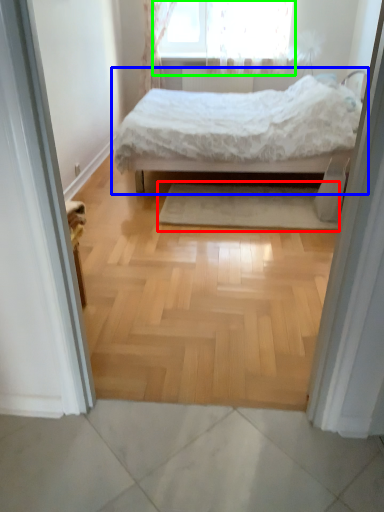
Question: Considering the real-world distances, which object is farthest from mat (highlighted by a red box)? bed (highlighted by a blue box) or window (highlighted by a green box)?

Choices:
 (A) bed
 (B) window

Answer: (B)